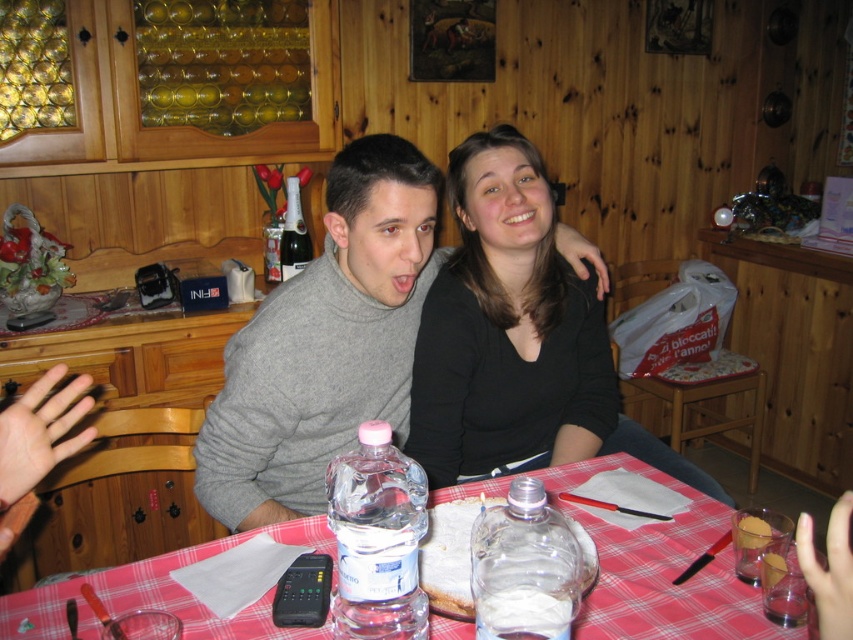
Question: Among these objects, which one is farthest from the camera?

Choices:
 (A) gray wool sweater at center
 (B) black matte shirt at center
 (C) transparent plastic water bottle at table
 (D) black glass bottle at center

Answer: (D)

Question: Does gray wool sweater at center have a greater width compared to clear plastic bottle at table center?

Choices:
 (A) no
 (B) yes

Answer: (B)

Question: Can you confirm if black matte shirt at center is smaller than clear plastic bottle at table center?

Choices:
 (A) yes
 (B) no

Answer: (B)

Question: Which is farther from the black matte shirt at center?

Choices:
 (A) transparent plastic water bottle at table
 (B) clear plastic bottle at table center
 (C) black glass bottle at center
 (D) checkered fabric tablecloth at center

Answer: (C)

Question: Which object appears closest to the camera in this image?

Choices:
 (A) transparent plastic water bottle at table
 (B) black matte shirt at center

Answer: (A)

Question: Is black matte shirt at center closer to the viewer compared to clear plastic bottle at table center?

Choices:
 (A) yes
 (B) no

Answer: (B)